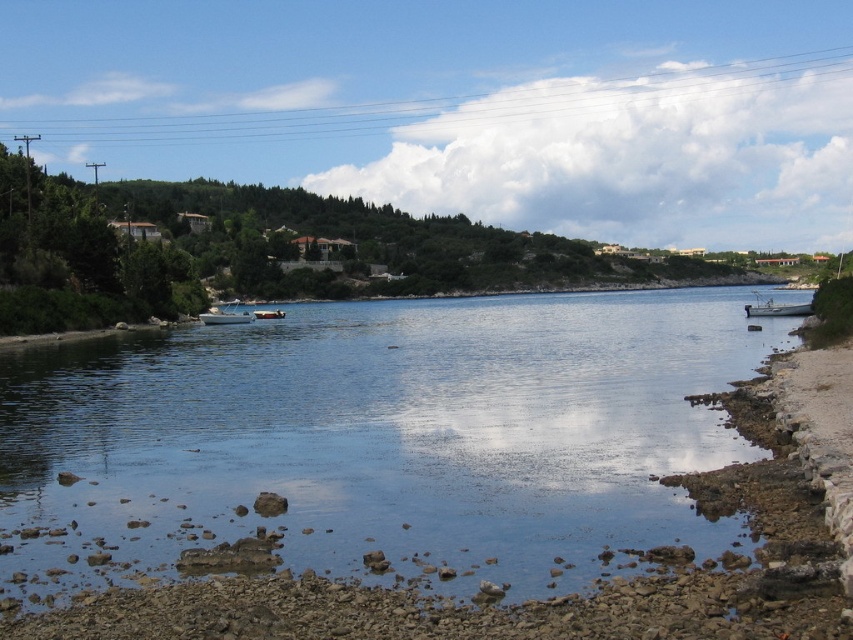
Can you confirm if white glossy boat at center-left is positioned below white glossy boat at center?

Incorrect, white glossy boat at center-left is not positioned below white glossy boat at center.

Is point (252, 317) behind point (256, 314)?

That is False.

Does point (231, 317) lie in front of point (270, 310)?

Yes, it is.

At what (x,y) coordinates should I click in order to perform the action: click on white glossy boat at center-left. Please return your answer as a coordinate pair (x, y). The height and width of the screenshot is (640, 853). Looking at the image, I should click on (225, 316).

Is clear water at center to the left of white fiberglass boat at right from the viewer's perspective?

Yes, clear water at center is to the left of white fiberglass boat at right.

Between point (189, 333) and point (773, 310), which one is positioned behind?

Positioned behind is point (189, 333).

Find the location of a particular element. The width and height of the screenshot is (853, 640). clear water at center is located at coordinates click(381, 436).

Is point (787, 305) positioned in front of point (283, 316)?

Yes, it is in front of point (283, 316).

Between white fiberglass boat at right and white glossy boat at center, which one has more height?

With more height is white glossy boat at center.

Does point (811, 310) come closer to viewer compared to point (271, 314)?

Yes, point (811, 310) is closer to viewer.

You are a GUI agent. You are given a task and a screenshot of the screen. Output one action in this format:
    pyautogui.click(x=<x>, y=<y>)
    Task: Click on the white fiberglass boat at right
    Image resolution: width=853 pixels, height=640 pixels.
    Given the screenshot: What is the action you would take?
    pyautogui.click(x=775, y=307)